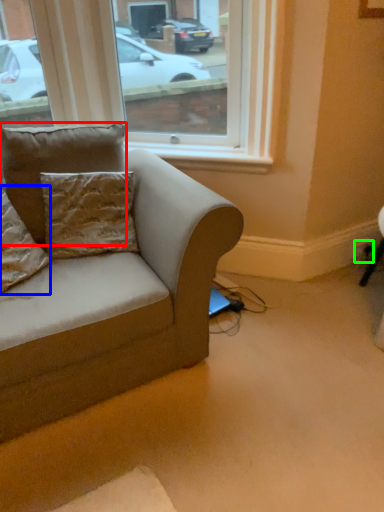
Question: Which object is positioned farthest from pillow (highlighted by a red box)? Select from pillow (highlighted by a blue box) and electric outlet (highlighted by a green box).

Choices:
 (A) pillow
 (B) electric outlet

Answer: (B)